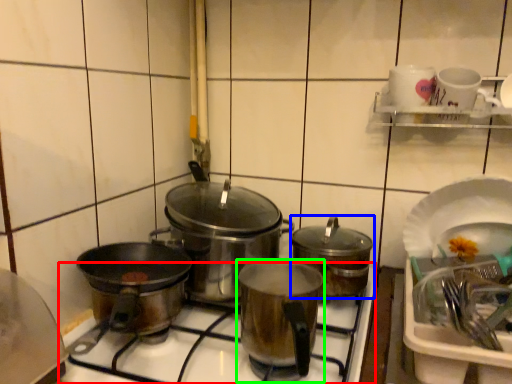
Question: Which object is the farthest from gas stove (highlighted by a red box)? Choose among these: kitchen appliance (highlighted by a blue box) or kitchen appliance (highlighted by a green box).

Choices:
 (A) kitchen appliance
 (B) kitchen appliance

Answer: (A)